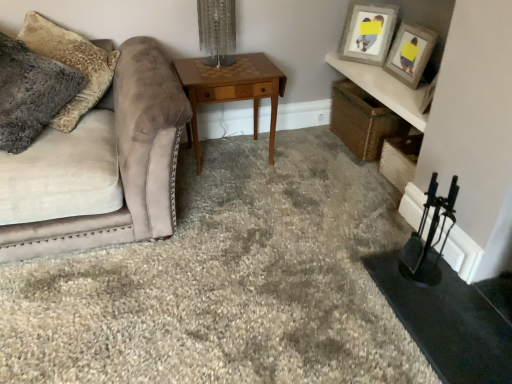
Locate an element on the screen. The image size is (512, 384). matte gray picture frame at upper right, arranged as the 2th picture frame when viewed from the left is located at coordinates (410, 53).

In order to face suede couch at left, should I rotate leftwards or rightwards?

It's best to rotate left around 23.096 degrees.

The image size is (512, 384). What do you see at coordinates (71, 64) in the screenshot? I see `fuzzy gray pillow at left` at bounding box center [71, 64].

Measure the distance between point (x=57, y=120) and camera.

Point (x=57, y=120) is 2.07 meters away from camera.

Identify the location of matte gray picture frame at upper right, arranged as the 2th picture frame when viewed from the left. This screenshot has height=384, width=512. (410, 53).

Is matte gray picture frame at upper right, arranged as the second picture frame when viewed from the right, touching suede couch at left?

No, matte gray picture frame at upper right, arranged as the second picture frame when viewed from the right, is not making contact with suede couch at left.

Can you confirm if matte gray picture frame at upper right, which appears as the first picture frame when viewed from the left, is wider than suede couch at left?

In fact, matte gray picture frame at upper right, which appears as the first picture frame when viewed from the left, might be narrower than suede couch at left.

From the image's perspective, is matte gray picture frame at upper right, which appears as the first picture frame when viewed from the left, above or below suede couch at left?

matte gray picture frame at upper right, which appears as the first picture frame when viewed from the left, is situated higher than suede couch at left in the image.

Which object is wider, clear glass table lamp at center or matte gray picture frame at upper right, arranged as the second picture frame when viewed from the right?

With larger width is clear glass table lamp at center.

Is clear glass table lamp at center far from matte gray picture frame at upper right, which appears as the first picture frame when viewed from the left?

That's not correct — clear glass table lamp at center is a little close to matte gray picture frame at upper right, which appears as the first picture frame when viewed from the left.

Does clear glass table lamp at center have a greater height compared to matte gray picture frame at upper right, which appears as the first picture frame when viewed from the left?

Incorrect, the height of clear glass table lamp at center is not larger of that of matte gray picture frame at upper right, which appears as the first picture frame when viewed from the left.

From a real-world perspective, which object rests below the other?

From a 3D spatial view, matte gray picture frame at upper right, arranged as the second picture frame when viewed from the right, is below.

Which object is further away from the camera taking this photo, fuzzy gray pillow at left or clear glass table lamp at center?

clear glass table lamp at center is more distant.

From the image's perspective, does fuzzy gray pillow at left appear lower than clear glass table lamp at center?

Indeed, from the image's perspective, fuzzy gray pillow at left is shown beneath clear glass table lamp at center.

Is fuzzy gray pillow at left not near clear glass table lamp at center?

No, fuzzy gray pillow at left is not far away from clear glass table lamp at center.

Is woodenobject at center inside or outside of suede couch at left?

woodenobject at center is located beyond the bounds of suede couch at left.

Is the depth of woodenobject at center greater than that of suede couch at left?

Yes, woodenobject at center is further from the camera.

Is woodenobject at center turned away from suede couch at left?

No, suede couch at left is not at the back of woodenobject at center.

How distant is fuzzy gray pillow at left from woodenobject at center?

fuzzy gray pillow at left and woodenobject at center are 59.42 centimeters apart from each other.

Consider the image. From a real-world perspective, is fuzzy gray pillow at left positioned above or below woodenobject at center?

fuzzy gray pillow at left is situated higher than woodenobject at center in the real world.

Are fuzzy gray pillow at left and woodenobject at center making contact?

No.

Who is shorter, fuzzy gray pillow at left or woodenobject at center?

woodenobject at center.

Considering the sizes of objects clear glass table lamp at center and fuzzy gray pillow at left in the image provided, who is bigger, clear glass table lamp at center or fuzzy gray pillow at left?

With larger size is fuzzy gray pillow at left.

Considering the sizes of objects clear glass table lamp at center and fuzzy gray pillow at left in the image provided, who is shorter, clear glass table lamp at center or fuzzy gray pillow at left?

clear glass table lamp at center.

Is fuzzy gray pillow at left completely or partially inside clear glass table lamp at center?

Actually, fuzzy gray pillow at left is outside clear glass table lamp at center.

Between clear glass table lamp at center and fuzzy gray pillow at left, which one has larger width?

With larger width is fuzzy gray pillow at left.

Which of these two, fuzzy gray pillow at left or matte gray picture frame at upper right, arranged as the second picture frame when viewed from the right, stands shorter?

matte gray picture frame at upper right, arranged as the second picture frame when viewed from the right, is shorter.

Can you tell me how much fuzzy gray pillow at left and matte gray picture frame at upper right, which appears as the first picture frame when viewed from the left, differ in facing direction?

There is a 56.3-degree angle between the facing directions of fuzzy gray pillow at left and matte gray picture frame at upper right, which appears as the first picture frame when viewed from the left.

Can matte gray picture frame at upper right, which appears as the first picture frame when viewed from the left, be found inside fuzzy gray pillow at left?

That's incorrect, matte gray picture frame at upper right, which appears as the first picture frame when viewed from the left, is not inside fuzzy gray pillow at left.

Which picture frame is the 1st one when counting from the right side of the suede couch at left? Please provide its 2D coordinates.

[(367, 32)]

Identify the location of table lamp that appears above the matte gray picture frame at upper right, which appears as the first picture frame when viewed from the left (from a real-world perspective). (217, 31).

From the image, which object appears to be nearer to matte gray picture frame at upper right, the first picture frame positioned from the right, fuzzy gray pillow at left or clear glass table lamp at center?

clear glass table lamp at center is positioned closer to the anchor matte gray picture frame at upper right, the first picture frame positioned from the right.

Estimate the real-world distances between objects in this image. Which object is closer to suede couch at left, clear glass table lamp at center or matte gray picture frame at upper right, arranged as the second picture frame when viewed from the right?

Among the two, clear glass table lamp at center is located nearer to suede couch at left.

From the image, which object appears to be farther from clear glass table lamp at center, matte gray picture frame at upper right, which appears as the first picture frame when viewed from the left, or fuzzy gray pillow at left?

matte gray picture frame at upper right, which appears as the first picture frame when viewed from the left.

Considering their positions, is woodenobject at center positioned closer to matte gray picture frame at upper right, which appears as the first picture frame when viewed from the left, than matte gray picture frame at upper right, arranged as the 2th picture frame when viewed from the left?

matte gray picture frame at upper right, arranged as the 2th picture frame when viewed from the left, lies closer to matte gray picture frame at upper right, which appears as the first picture frame when viewed from the left, than the other object.

Estimate the real-world distances between objects in this image. Which object is closer to matte gray picture frame at upper right, which appears as the first picture frame when viewed from the left, suede couch at left or matte gray picture frame at upper right, arranged as the 2th picture frame when viewed from the left?

The object closer to matte gray picture frame at upper right, which appears as the first picture frame when viewed from the left, is matte gray picture frame at upper right, arranged as the 2th picture frame when viewed from the left.

Which object lies nearer to the anchor point matte gray picture frame at upper right, arranged as the 2th picture frame when viewed from the left, matte gray picture frame at upper right, which appears as the first picture frame when viewed from the left, or fuzzy gray pillow at left?

matte gray picture frame at upper right, which appears as the first picture frame when viewed from the left.

When comparing their distances from suede couch at left, does matte gray picture frame at upper right, the first picture frame positioned from the right, or matte gray picture frame at upper right, which appears as the first picture frame when viewed from the left, seem closer?

Among the two, matte gray picture frame at upper right, which appears as the first picture frame when viewed from the left, is located nearer to suede couch at left.

Considering their positions, is fuzzy gray pillow at left positioned closer to matte gray picture frame at upper right, arranged as the 2th picture frame when viewed from the left, than suede couch at left?

Among the two, suede couch at left is located nearer to matte gray picture frame at upper right, arranged as the 2th picture frame when viewed from the left.

Where is `table located between suede couch at left and matte gray picture frame at upper right, which appears as the first picture frame when viewed from the left, in the left-right direction`? The height and width of the screenshot is (384, 512). table located between suede couch at left and matte gray picture frame at upper right, which appears as the first picture frame when viewed from the left, in the left-right direction is located at coordinates (232, 89).

At what (x,y) coordinates should I click in order to perform the action: click on picture frame between fuzzy gray pillow at left and matte gray picture frame at upper right, arranged as the 2th picture frame when viewed from the left, in the horizontal direction. Please return your answer as a coordinate pair (x, y). The width and height of the screenshot is (512, 384). Looking at the image, I should click on (367, 32).

Where is `table lamp located between suede couch at left and matte gray picture frame at upper right, arranged as the second picture frame when viewed from the right, in the left-right direction`? Image resolution: width=512 pixels, height=384 pixels. table lamp located between suede couch at left and matte gray picture frame at upper right, arranged as the second picture frame when viewed from the right, in the left-right direction is located at coordinates (217, 31).

At what (x,y) coordinates should I click in order to perform the action: click on studio couch located between fuzzy gray pillow at left and clear glass table lamp at center in the left-right direction. Please return your answer as a coordinate pair (x, y). Looking at the image, I should click on (101, 166).